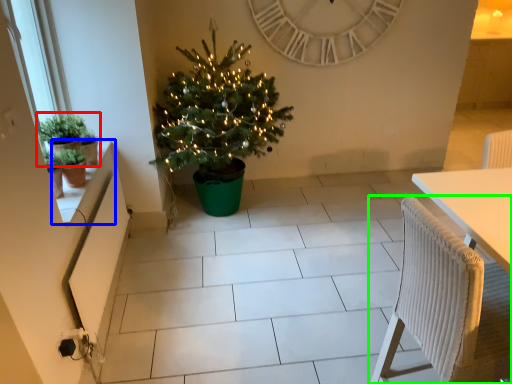
Question: Based on their relative distances, which object is farther from houseplant (highlighted by a red box)? Choose from window sill (highlighted by a blue box) and chair (highlighted by a green box).

Choices:
 (A) window sill
 (B) chair

Answer: (B)